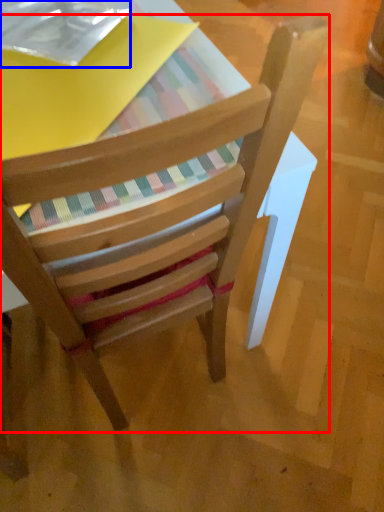
Question: Which object appears closest to the camera in this image, chair (highlighted by a red box) or paperback book (highlighted by a blue box)?

Choices:
 (A) chair
 (B) paperback book

Answer: (A)